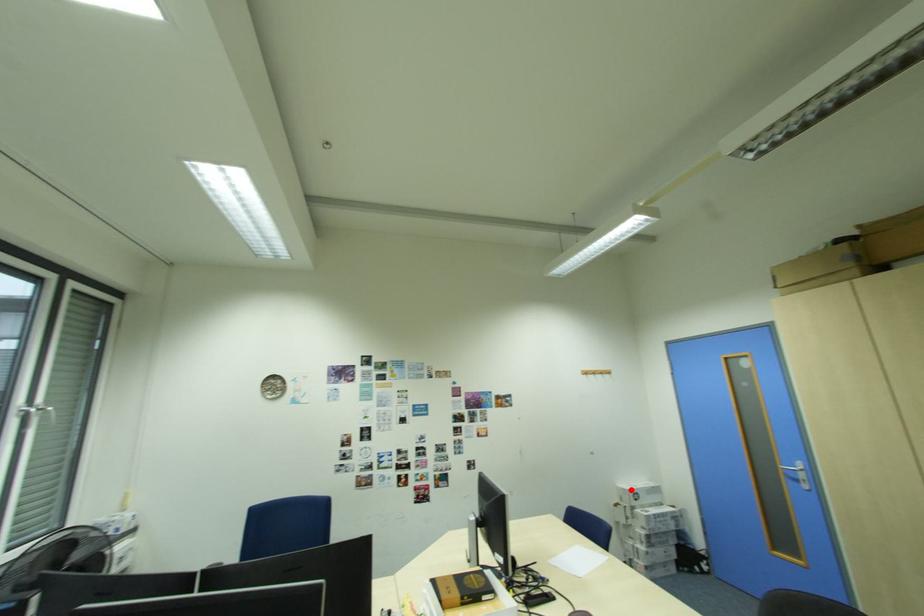
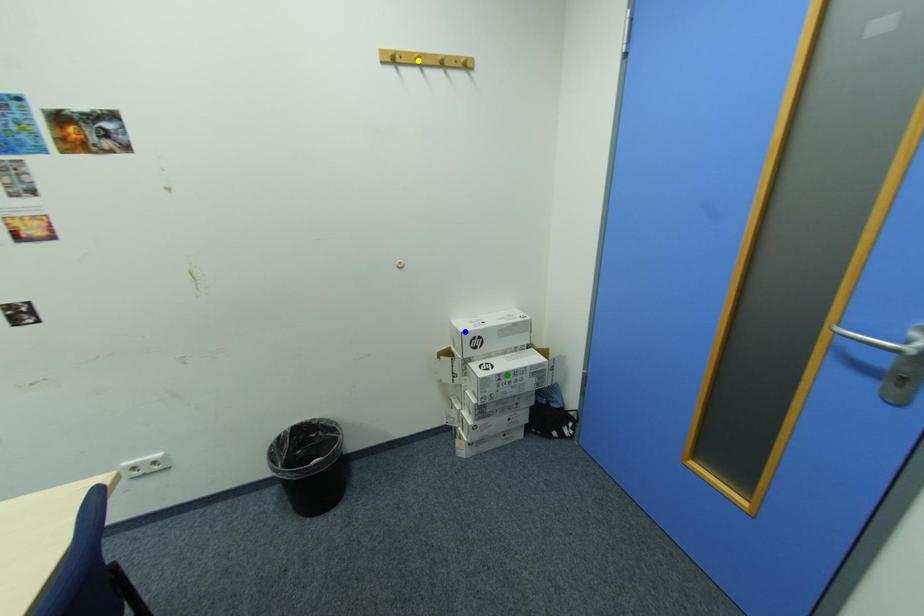
Question: I am providing you with two images of the same scene from different viewpoints. A red point is marked on the first image. You are given multiple points on the second image. Which mark in image 2 goes with the point in image 1?

Choices:
 (A) blue point
 (B) green point
 (C) yellow point

Answer: (A)